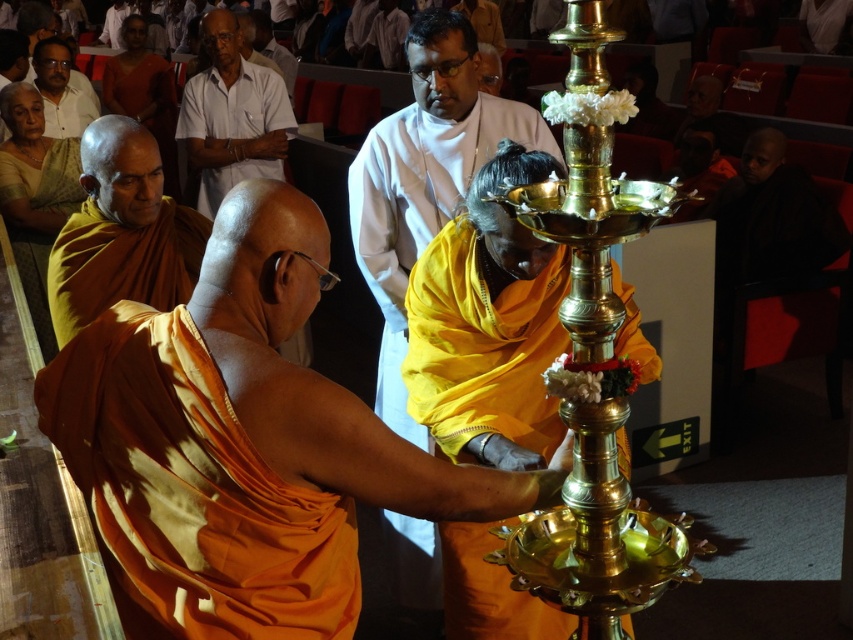
Which is behind, point (613, 342) or point (192, 148)?

The point (192, 148) is more distant.

Describe the element at coordinates (488, 324) in the screenshot. I see `golden polished oil lamp at center` at that location.

The width and height of the screenshot is (853, 640). What are the coordinates of `golden polished oil lamp at center` in the screenshot? It's located at (488, 324).

Who is positioned more to the right, orange draped cloth at center or orange clothed monk at left?

Positioned to the right is orange draped cloth at center.

Which of these two, orange draped cloth at center or orange clothed monk at left, stands taller?

orange clothed monk at left

Which is behind, point (126, 502) or point (91, 291)?

The point (91, 291) is more distant.

At what (x,y) coordinates should I click in order to perform the action: click on orange draped cloth at center. Please return your answer as a coordinate pair (x, y). This screenshot has height=640, width=853. Looking at the image, I should click on (190, 490).

Between orange draped cloth at center and golden polished oil lamp at center, which one has more height?

golden polished oil lamp at center

Which is more to the right, orange draped cloth at center or golden polished oil lamp at center?

From the viewer's perspective, golden polished oil lamp at center appears more on the right side.

Does point (248, 440) come farther from viewer compared to point (556, 620)?

No, (248, 440) is closer to viewer.

Identify the location of orange draped cloth at center. (190, 490).